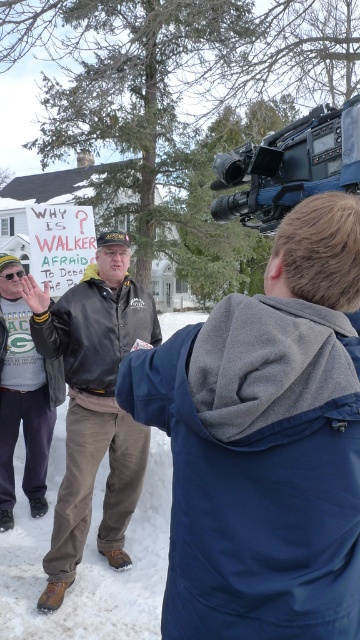
You are a photographer standing at the edge of the crowd. You want to take a closeup shot of the leather jacket at center without moving closer than 4 meters. Will you be able to capture the jacket clearly in your photo?

The leather jacket at center is 4.05 meters away from the viewer. Since the minimum distance you can move is 4 meters, you are just slightly beyond the required distance. Therefore, you might not be able to capture the jacket clearly without moving closer.

You are a photographer trying to capture both the leather jacket at center and the black plastic video camera at upper right in a single frame. Given their sizes, which object will appear bigger in the photo?

The leather jacket at center will appear bigger in the photo because it is larger in size than the black plastic video camera at upper right.

You are a photographer trying to capture a clear shot of the leather jacket at center and the black plastic video camera at upper right. Based on their positions, which object would be in the foreground of your photo?

The leather jacket at center is below the black plastic video camera at upper right, so the leather jacket at center would be in the foreground of the photo because it is positioned lower in the frame.